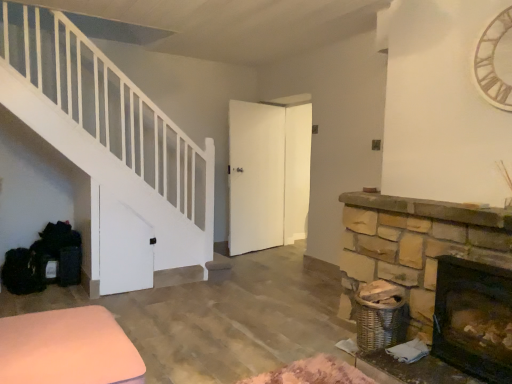
Question: From a real-world perspective, is dark brown stone fireplace at lower right positioned above or below pink fabric ottoman at lower left?

Choices:
 (A) below
 (B) above

Answer: (B)

Question: Considering the positions of point (439, 336) and point (98, 329), is point (439, 336) closer or farther from the camera than point (98, 329)?

Choices:
 (A) closer
 (B) farther

Answer: (B)

Question: Which is nearer to the dark brown stone fireplace at lower right?

Choices:
 (A) wooden clock at upper right
 (B) pink fabric ottoman at lower left

Answer: (A)

Question: Considering the real-world distances, which object is farthest from the dark brown stone fireplace at lower right?

Choices:
 (A) pink fabric ottoman at lower left
 (B) wooden clock at upper right

Answer: (A)